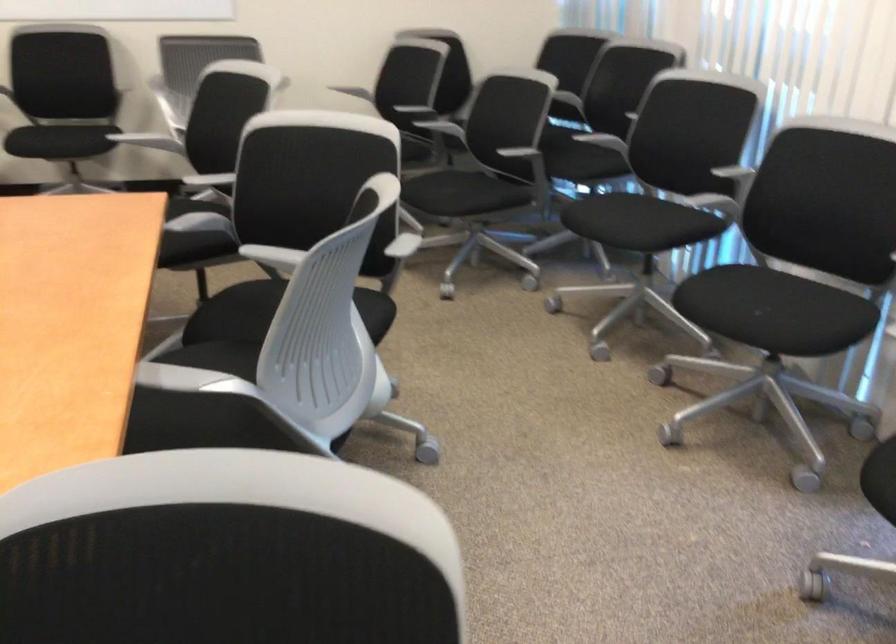
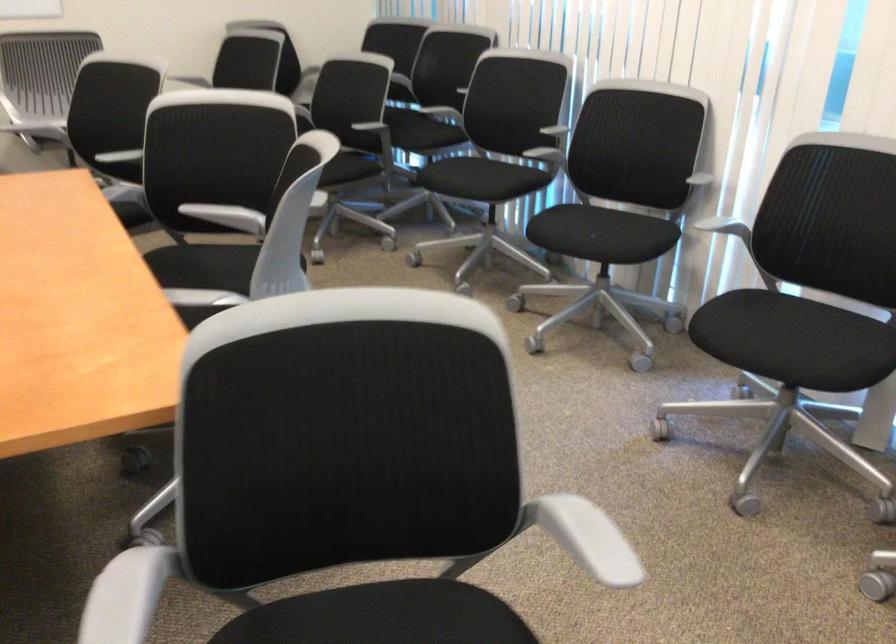
In the second image, find the point that corresponds to (718,185) in the first image.

(543, 146)